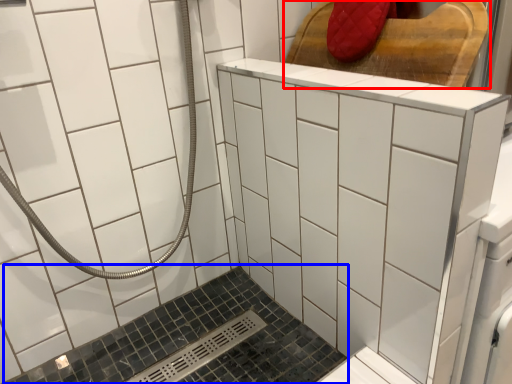
Question: Which point is further to the camera, furniture (highlighted by a red box) or bath (highlighted by a blue box)?

Choices:
 (A) furniture
 (B) bath

Answer: (A)